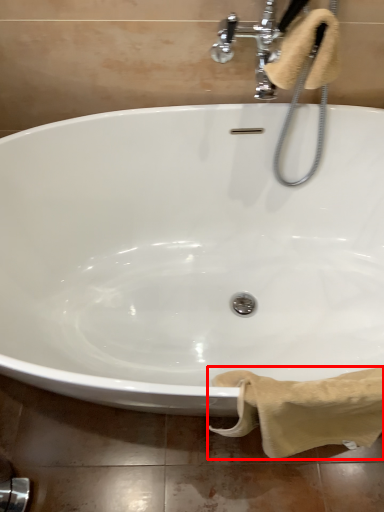
Question: Where is bath towel (annotated by the red box) located in relation to bath towel in the image?

Choices:
 (A) right
 (B) left

Answer: (A)